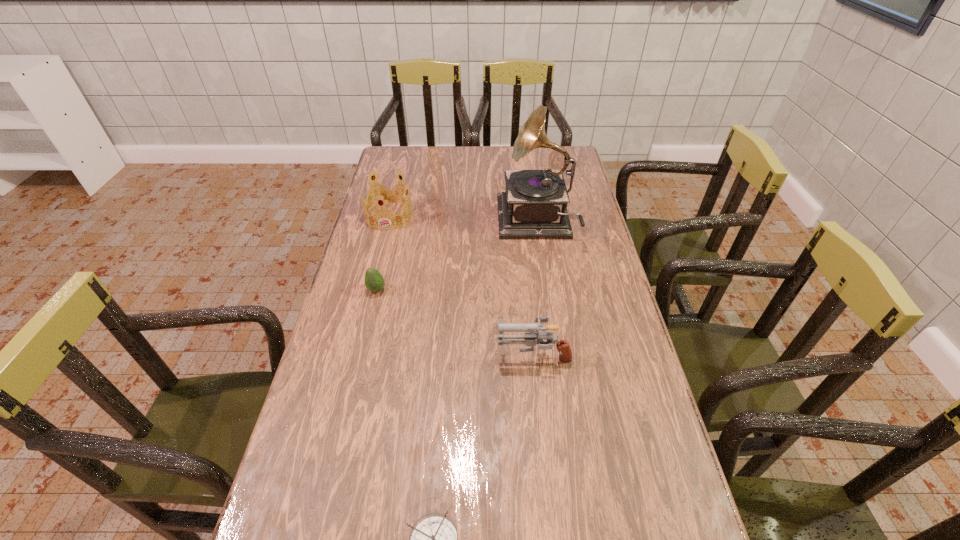
You are a GUI agent. You are given a task and a screenshot of the screen. Output one action in this format:
    pyautogui.click(x=<x>, y=<y>)
    Task: Click on the tallest object
    The image size is (960, 540).
    Given the screenshot: What is the action you would take?
    pyautogui.click(x=535, y=203)

The height and width of the screenshot is (540, 960). Identify the location of crown. (385, 195).

Where is `gun`? This screenshot has height=540, width=960. gun is located at coordinates (532, 339).

You are a GUI agent. You are given a task and a screenshot of the screen. Output one action in this format:
    pyautogui.click(x=<x>, y=<y>)
    Task: Click on the fourth tallest object
    
    Given the screenshot: What is the action you would take?
    pyautogui.click(x=374, y=282)

Identify the location of avocado. The image size is (960, 540). (374, 282).

Find the location of `free space located 0.230m on the horn of the tallest object`. free space located 0.230m on the horn of the tallest object is located at coordinates (434, 222).

The image size is (960, 540). I want to click on vacant space located on the horn of the tallest object, so click(x=443, y=222).

Find the location of a particular element. The image size is (960, 540). vacant space located 0.050m on the horn of the tallest object is located at coordinates (484, 222).

Where is `blank area located 0.080m on the right of the crown`? blank area located 0.080m on the right of the crown is located at coordinates (435, 216).

This screenshot has width=960, height=540. Find the location of `free space located at the barrel end of the gun`. free space located at the barrel end of the gun is located at coordinates (395, 354).